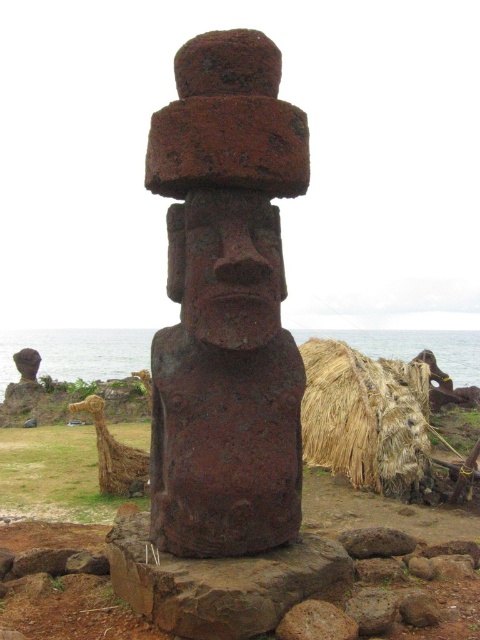
Can you confirm if rusty stone statue at center is shorter than brown straw mat at lower right?

In fact, rusty stone statue at center may be taller than brown straw mat at lower right.

Can you confirm if rusty stone statue at center is taller than brown straw mat at lower right?

Yes, rusty stone statue at center is taller than brown straw mat at lower right.

Is point (157, 545) farther from camera compared to point (312, 448)?

No, it is in front of (312, 448).

Find the location of a particular element. rusty stone statue at center is located at coordinates (226, 305).